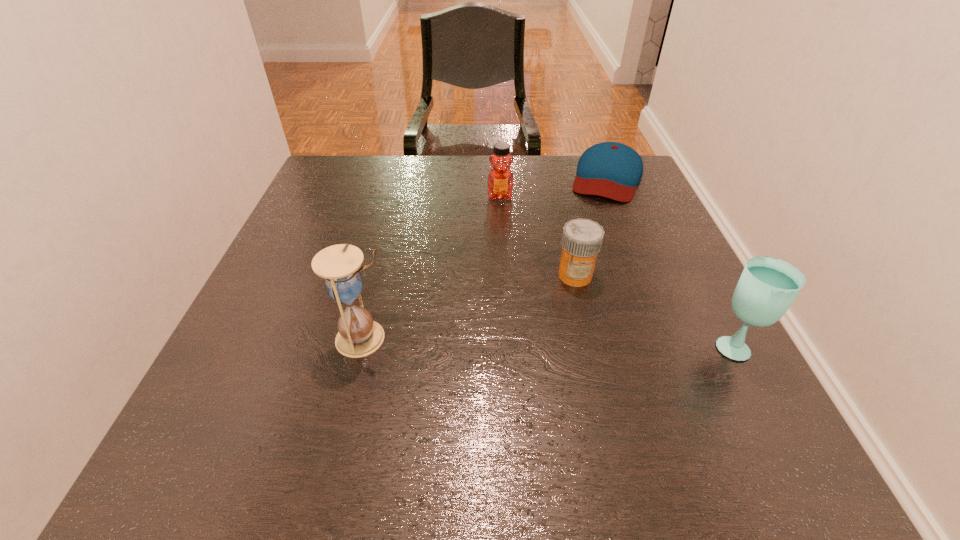
Where is `the leftmost object`? The width and height of the screenshot is (960, 540). the leftmost object is located at coordinates (358, 335).

At what (x,y) coordinates should I click in order to perform the action: click on the tallest object. Please return your answer as a coordinate pair (x, y). Looking at the image, I should click on (358, 335).

I want to click on the fourth shortest object, so click(x=768, y=286).

This screenshot has width=960, height=540. What are the coordinates of `the third farthest object` in the screenshot? It's located at (582, 239).

You are a GUI agent. You are given a task and a screenshot of the screen. Output one action in this format:
    pyautogui.click(x=<x>, y=<y>)
    Task: Click on the third object from left to right
    The image size is (960, 540).
    Given the screenshot: What is the action you would take?
    pyautogui.click(x=582, y=239)

I want to click on the third tallest object, so click(x=500, y=181).

Where is `the fourth object from right to left`? The height and width of the screenshot is (540, 960). the fourth object from right to left is located at coordinates [x=500, y=181].

Find the location of a particular element. The image size is (960, 540). the shortest object is located at coordinates (613, 170).

Image resolution: width=960 pixels, height=540 pixels. I want to click on free point located on the right of the hourglass, so click(x=529, y=338).

In order to click on vacant space located 0.160m on the left of the glass in this screenshot , I will do `click(623, 345)`.